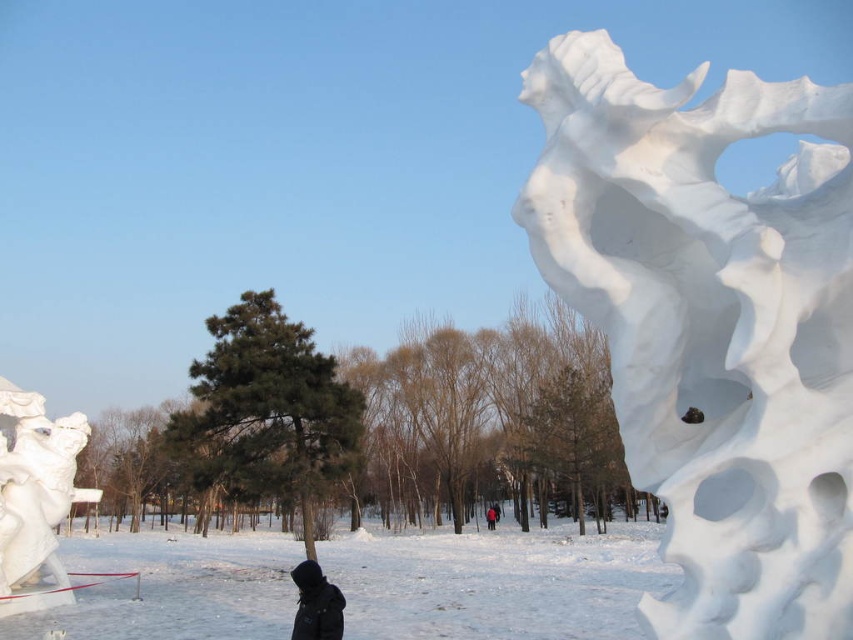
Question: Does white snow at lower center appear under black matte jacket at lower center?

Choices:
 (A) yes
 (B) no

Answer: (A)

Question: Does white snow at lower center appear on the left side of black matte jacket at lower center?

Choices:
 (A) yes
 (B) no

Answer: (B)

Question: Does white snow sculpture at upper right have a smaller size compared to red matte jacket at center?

Choices:
 (A) no
 (B) yes

Answer: (A)

Question: Which of the following is the closest to the observer?

Choices:
 (A) white snow sculpture at upper right
 (B) red matte jacket at center
 (C) white glossy statue at lower left

Answer: (A)

Question: Which point is farther to the camera?

Choices:
 (A) white snow at lower center
 (B) red matte jacket at center
 (C) white glossy statue at lower left

Answer: (B)

Question: Which point is closer to the camera?

Choices:
 (A) red matte jacket at center
 (B) white glossy statue at lower left

Answer: (B)